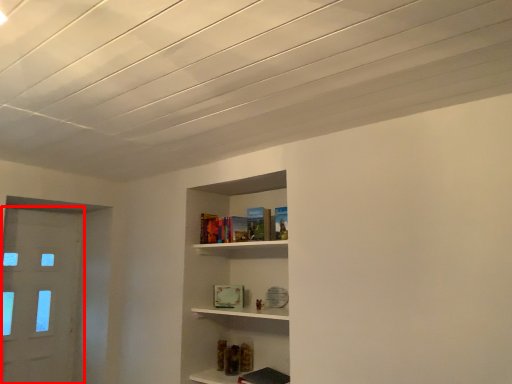
Question: Observing the image, what is the correct spatial positioning of door (annotated by the red box) in reference to book?

Choices:
 (A) right
 (B) left

Answer: (B)